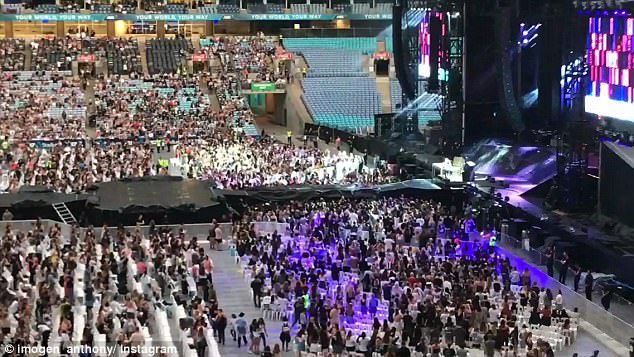
Find the location of `huge video screens`. huge video screens is located at coordinates (614, 76), (423, 49).